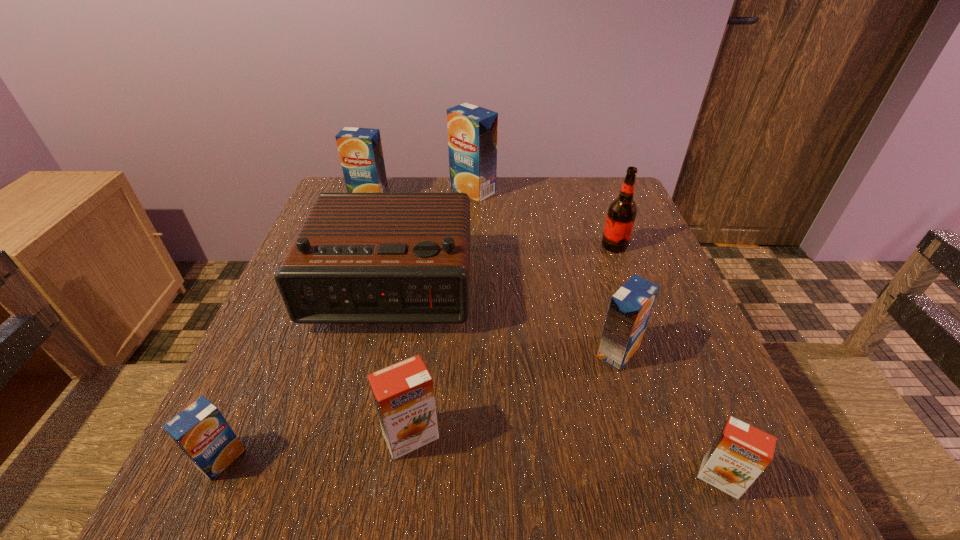
You are a GUI agent. You are given a task and a screenshot of the screen. Output one action in this format:
    pyautogui.click(x=<x>, y=<y>)
    Task: Click on the free region at the near right corner of the desktop
    The height and width of the screenshot is (540, 960).
    Given the screenshot: What is the action you would take?
    pyautogui.click(x=671, y=495)

Identify the location of blank region between the rightmost orange juice and the tallest orange juice. (597, 334).

I want to click on empty space that is in between the bigger orange orange juice and the rightmost orange juice, so click(565, 457).

You are a GUI agent. You are given a task and a screenshot of the screen. Output one action in this format:
    pyautogui.click(x=<x>, y=<y>)
    Task: Click on the vacant space in between the rightmost orange juice and the fifth shortest orange juice
    This screenshot has height=540, width=960.
    Given the screenshot: What is the action you would take?
    pyautogui.click(x=545, y=338)

Where is `free space between the third farthest blue orange_juice and the right orange orange juice`? This screenshot has height=540, width=960. free space between the third farthest blue orange_juice and the right orange orange juice is located at coordinates (669, 415).

Locate an element on the screen. The image size is (960, 540). free space that is in between the third smallest blue orange_juice and the second smallest blue orange_juice is located at coordinates (493, 275).

Locate an element on the screen. object that is the nearest to the root beer is located at coordinates pos(630,308).

Where is `object that is the second closest to the second tallest orange juice`? Image resolution: width=960 pixels, height=540 pixels. object that is the second closest to the second tallest orange juice is located at coordinates (358, 258).

Find the location of a particular element. This screenshot has height=540, width=960. orange juice that is the sixth closest to the root beer is located at coordinates (200, 430).

Select which orange juice is the third closest to the rightmost blue orange_juice. Please provide its 2D coordinates. Your answer should be formatted as a tuple, i.e. [(x, y)], where the tuple contains the x and y coordinates of a point satisfying the conditions above.

[(472, 130)]